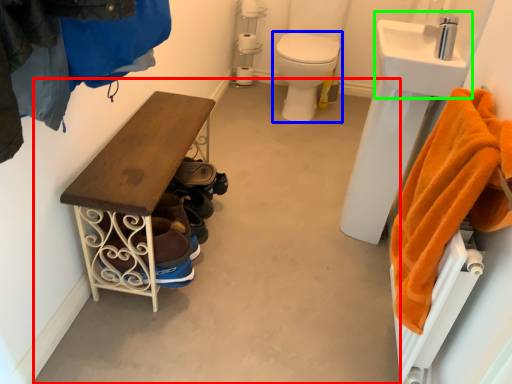
Question: Estimate the real-world distances between objects in this image. Which object is closer to concrete (highlighted by a red box), toilet (highlighted by a blue box) or sink (highlighted by a green box)?

Choices:
 (A) toilet
 (B) sink

Answer: (B)